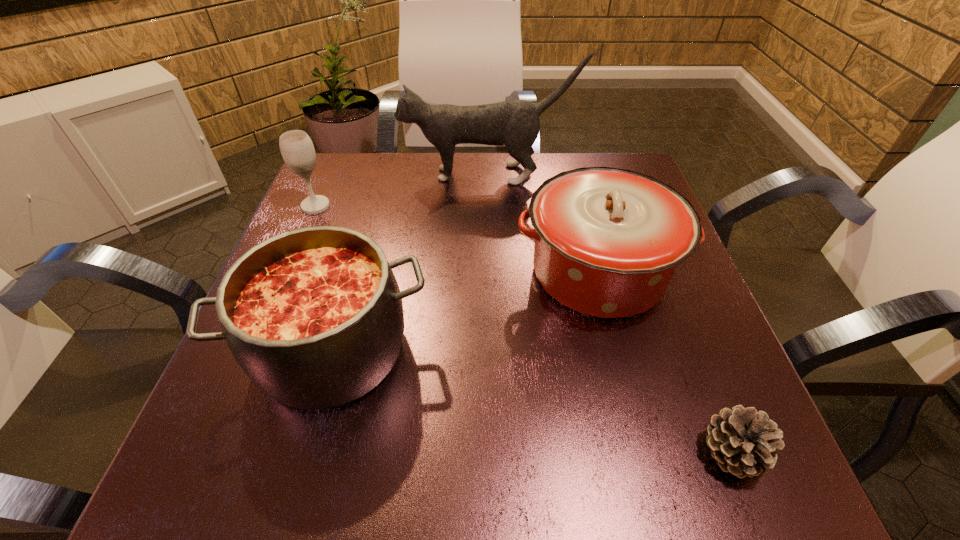
Find the location of a particular element. The image size is (960, 540). pinecone that is at the right edge is located at coordinates (743, 441).

Identify the location of object at the far left corner. point(297,149).

Find the location of a particular element. This screenshot has width=960, height=540. object that is at the near right corner is located at coordinates (743, 441).

In the image, there is a desktop. Identify the location of blank space at the far edge. (468, 176).

In the image, there is a desktop. Where is `free space at the near edge`? The height and width of the screenshot is (540, 960). free space at the near edge is located at coordinates (375, 484).

The width and height of the screenshot is (960, 540). In order to click on free space at the right edge of the desktop in this screenshot , I will do `click(712, 322)`.

Locate an element on the screen. The height and width of the screenshot is (540, 960). vacant space at the far left corner of the desktop is located at coordinates (331, 178).

You are a GUI agent. You are given a task and a screenshot of the screen. Output one action in this format:
    pyautogui.click(x=<x>, y=<y>)
    Task: Click on the free space at the near right corner of the desktop
    Image resolution: width=960 pixels, height=540 pixels.
    Given the screenshot: What is the action you would take?
    pyautogui.click(x=699, y=444)

Find the location of a particular element. This screenshot has height=540, width=960. empty space between the left casserole and the right casserole is located at coordinates (466, 311).

Where is `free space between the right casserole and the wineglass`? The width and height of the screenshot is (960, 540). free space between the right casserole and the wineglass is located at coordinates (457, 239).